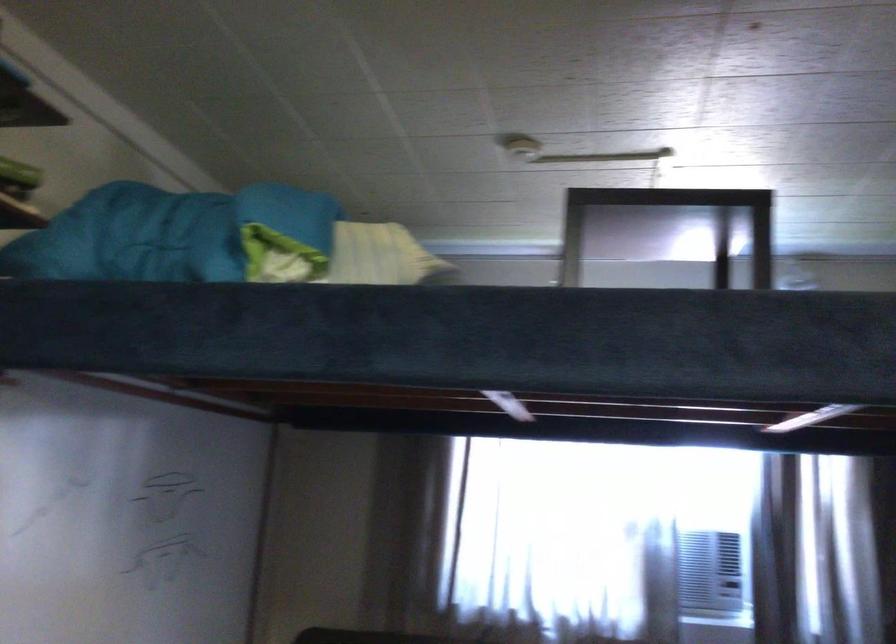
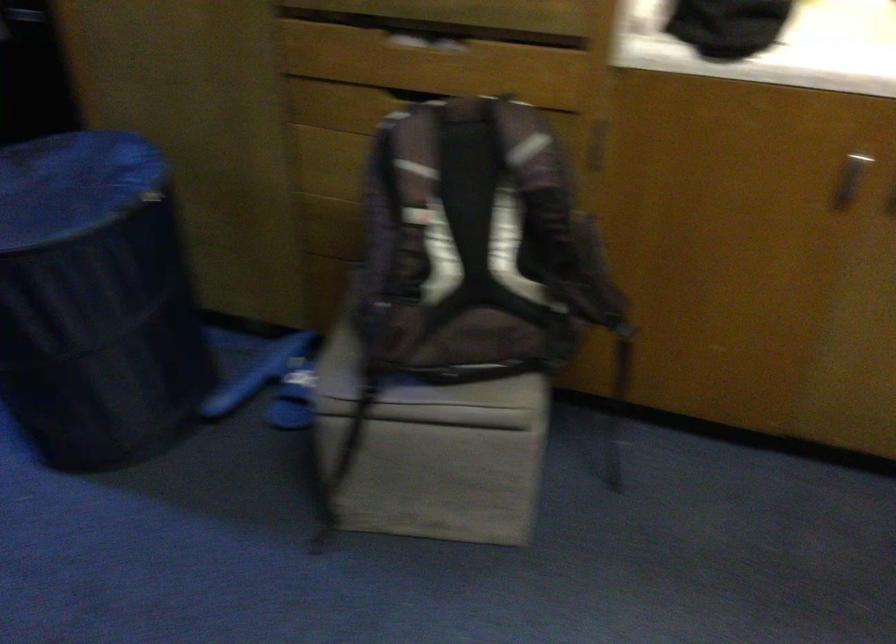
How did the camera likely rotate?

The camera's rotation is toward right-down.